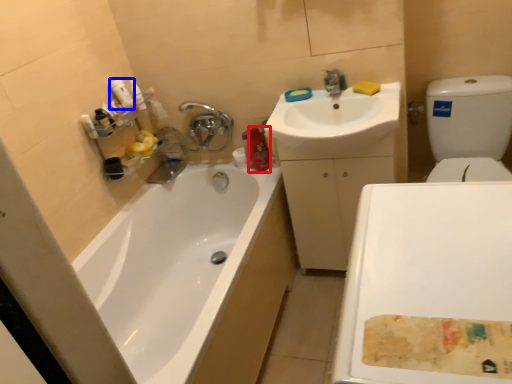
Question: Which of the following is the farthest to the observer, cleaning product (highlighted by a red box) or cleaning product (highlighted by a blue box)?

Choices:
 (A) cleaning product
 (B) cleaning product

Answer: (A)